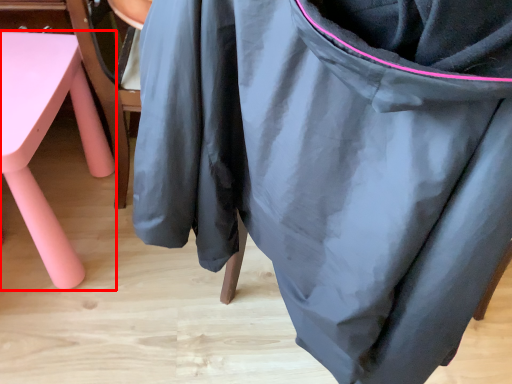
Question: From the image's perspective, considering the relative positions of furniture (annotated by the red box) and bean bag chair in the image provided, where is furniture (annotated by the red box) located with respect to the staircase?

Choices:
 (A) above
 (B) below

Answer: (A)